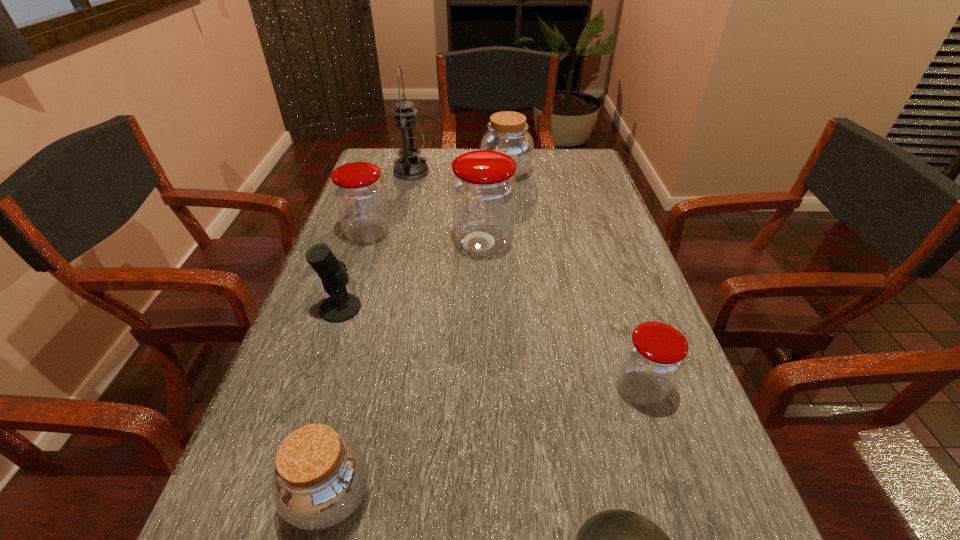
Where is `oil lamp`? The height and width of the screenshot is (540, 960). oil lamp is located at coordinates (407, 138).

Identify the location of the tallest object. (407, 138).

The height and width of the screenshot is (540, 960). In order to click on the second tallest object in this screenshot , I will do (x=483, y=189).

You are a GUI agent. You are given a task and a screenshot of the screen. Output one action in this format:
    pyautogui.click(x=<x>, y=<y>)
    Task: Click on the second red jar from left to right
    This screenshot has height=540, width=960.
    Given the screenshot: What is the action you would take?
    pyautogui.click(x=483, y=189)

This screenshot has height=540, width=960. I want to click on the farther brown jar, so click(507, 133).

Where is `the farthest jar`? the farthest jar is located at coordinates (507, 133).

You are a GUI agent. You are given a task and a screenshot of the screen. Output one action in this format:
    pyautogui.click(x=<x>, y=<y>)
    Task: Click on the leftmost red jar
    This screenshot has width=960, height=540.
    Given the screenshot: What is the action you would take?
    (359, 193)

Find the location of a particular element. microphone is located at coordinates click(x=341, y=306).

Find the location of a particular element. This screenshot has height=540, width=960. the smallest red jar is located at coordinates (654, 357).

The height and width of the screenshot is (540, 960). I want to click on the nearest red jar, so click(x=654, y=357).